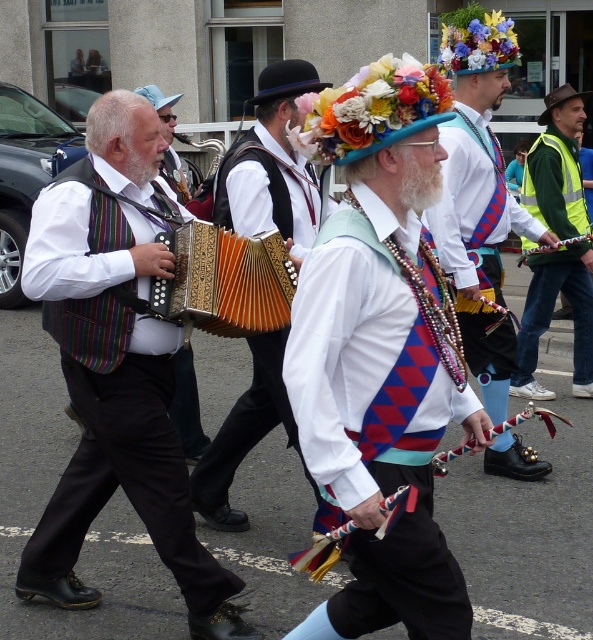
Is point (229, 179) behind point (215, 248)?

That is True.

Is point (225, 182) farther from camera compared to point (202, 240)?

Yes, point (225, 182) is behind point (202, 240).

Identify the location of matte black accordion at center. (272, 164).

This screenshot has width=593, height=640. Describe the element at coordinates (116, 369) in the screenshot. I see `striped fabric vest at left` at that location.

Which is behind, point (103, 172) or point (286, 257)?

The point (286, 257) is more distant.

The image size is (593, 640). Find the location of `striped fabric vest at left`. striped fabric vest at left is located at coordinates (116, 369).

Does matte black accordion at center appear on the left side of green reflective vest at right?

Yes, matte black accordion at center is to the left of green reflective vest at right.

Which is more to the left, matte black accordion at center or green reflective vest at right?

matte black accordion at center is more to the left.

Who is more forward, (313, 204) or (584, 333)?

Point (313, 204) is more forward.

What are the coordinates of `matte black accordion at center` in the screenshot? It's located at (272, 164).